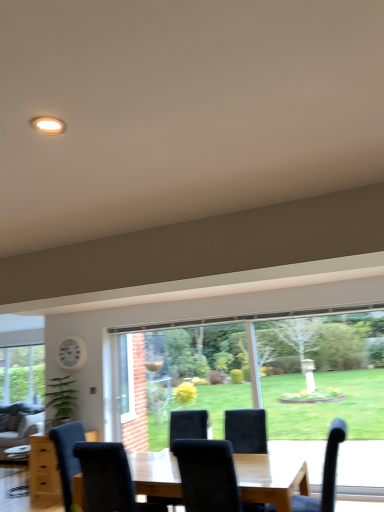
Question: From a real-world perspective, does velvet grey couch at lower left stand above white plastic clock at upper left?

Choices:
 (A) yes
 (B) no

Answer: (B)

Question: Is velvet grey couch at lower left next to white plastic clock at upper left and touching it?

Choices:
 (A) yes
 (B) no

Answer: (B)

Question: Is velvet grey couch at lower left positioned behind white plastic clock at upper left?

Choices:
 (A) yes
 (B) no

Answer: (A)

Question: Considering the relative sizes of velvet grey couch at lower left and white plastic clock at upper left in the image provided, is velvet grey couch at lower left thinner than white plastic clock at upper left?

Choices:
 (A) no
 (B) yes

Answer: (A)

Question: Is velvet grey couch at lower left located outside white plastic clock at upper left?

Choices:
 (A) no
 (B) yes

Answer: (B)

Question: Is white plastic clock at upper left at the back of velvet grey couch at lower left?

Choices:
 (A) yes
 (B) no

Answer: (B)

Question: Is velvet black chair at lower right, marked as the 2th chair in a left-to-right arrangement, positioned in front of velvet black chair at center, which is the 1th chair in left-to-right order?

Choices:
 (A) yes
 (B) no

Answer: (B)

Question: Is the depth of velvet black chair at lower right, acting as the 1th chair starting from the right, greater than that of velvet black chair at center, which is the 1th chair in left-to-right order?

Choices:
 (A) no
 (B) yes

Answer: (B)

Question: Is the surface of velvet black chair at lower right, marked as the 2th chair in a left-to-right arrangement, in direct contact with velvet black chair at center, which is the 1th chair in left-to-right order?

Choices:
 (A) no
 (B) yes

Answer: (A)

Question: Can you confirm if velvet black chair at lower right, acting as the 1th chair starting from the right, is positioned to the right of velvet black chair at center, the 2th chair positioned from the right?

Choices:
 (A) no
 (B) yes

Answer: (B)

Question: Is velvet black chair at lower right, acting as the 1th chair starting from the right, outside of velvet black chair at center, which is the 1th chair in left-to-right order?

Choices:
 (A) yes
 (B) no

Answer: (A)

Question: Is velvet black chair at lower right, acting as the 1th chair starting from the right, facing away from velvet black chair at center, which is the 1th chair in left-to-right order?

Choices:
 (A) yes
 (B) no

Answer: (B)

Question: Can you confirm if velvet black chair at lower right, marked as the 2th chair in a left-to-right arrangement, is taller than white plastic clock at upper left?

Choices:
 (A) no
 (B) yes

Answer: (B)